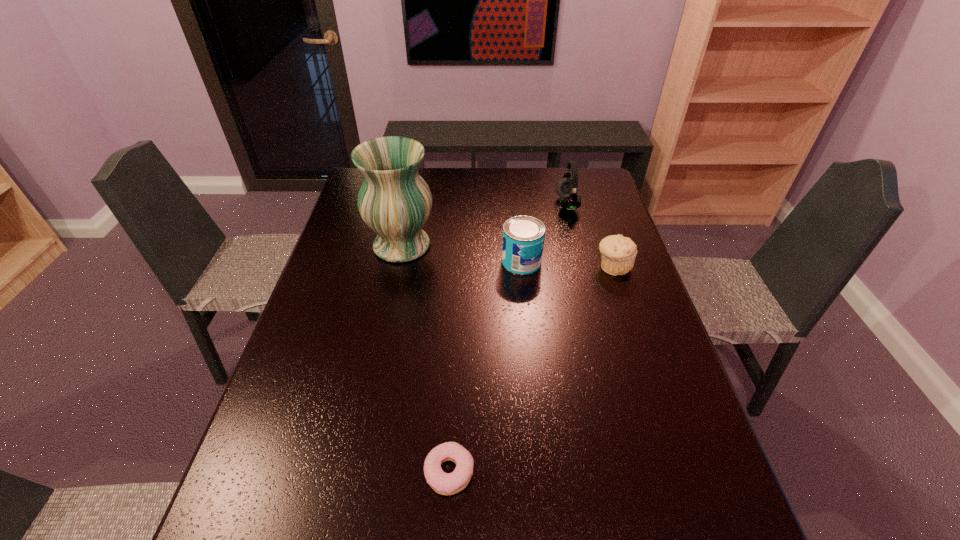
Find the location of `object located at the far right corner`. object located at the far right corner is located at coordinates click(x=567, y=188).

Where is `free space at the far edge of the desktop`? free space at the far edge of the desktop is located at coordinates (529, 167).

In the image, there is a desktop. In order to click on vacant space at the left edge in this screenshot , I will do `click(241, 508)`.

In the image, there is a desktop. Find the location of `vacant space at the right edge`. vacant space at the right edge is located at coordinates (574, 211).

Identify the location of vacant area that lies between the second object from left to right and the third object from left to right. Image resolution: width=960 pixels, height=540 pixels. (486, 367).

Find the location of a particular element. The image size is (960, 540). vacant point located between the can and the doughnut is located at coordinates (486, 367).

Identify the location of unoccupied area between the second shortest object and the nearest object. (531, 369).

Image resolution: width=960 pixels, height=540 pixels. In order to click on vacant point located between the fourth object from right to left and the second shortest object in this screenshot , I will do `click(531, 369)`.

Where is `free space between the can and the nearest object`? The width and height of the screenshot is (960, 540). free space between the can and the nearest object is located at coordinates (486, 367).

Locate an element on the screen. free space between the farthest object and the tallest object is located at coordinates (485, 225).